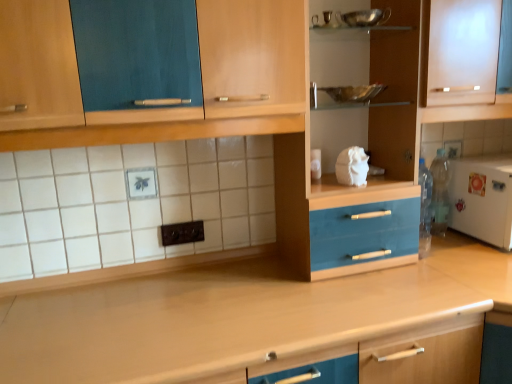
This screenshot has width=512, height=384. In order to click on vacant region above wooden at center (from a real-world perspective) in this screenshot , I will do `click(195, 312)`.